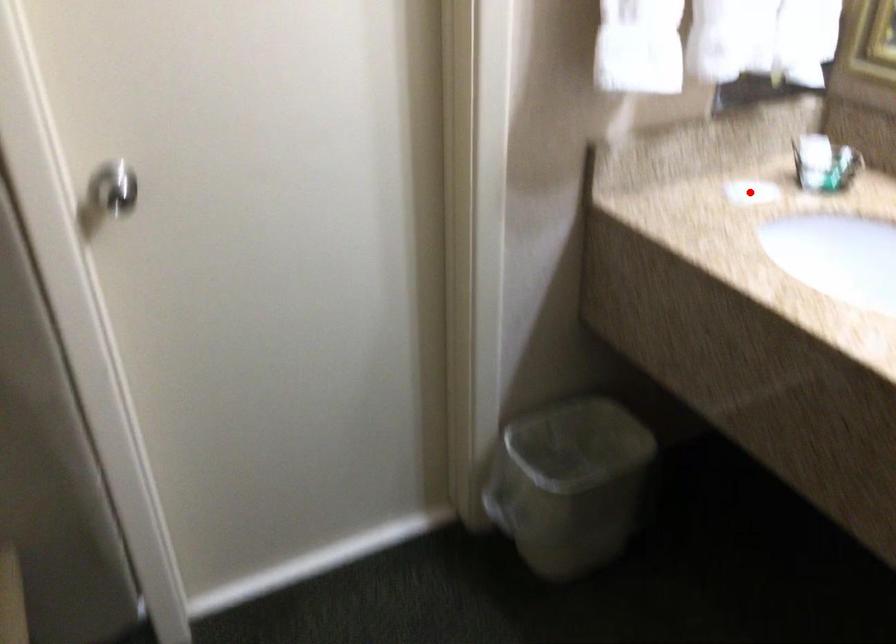
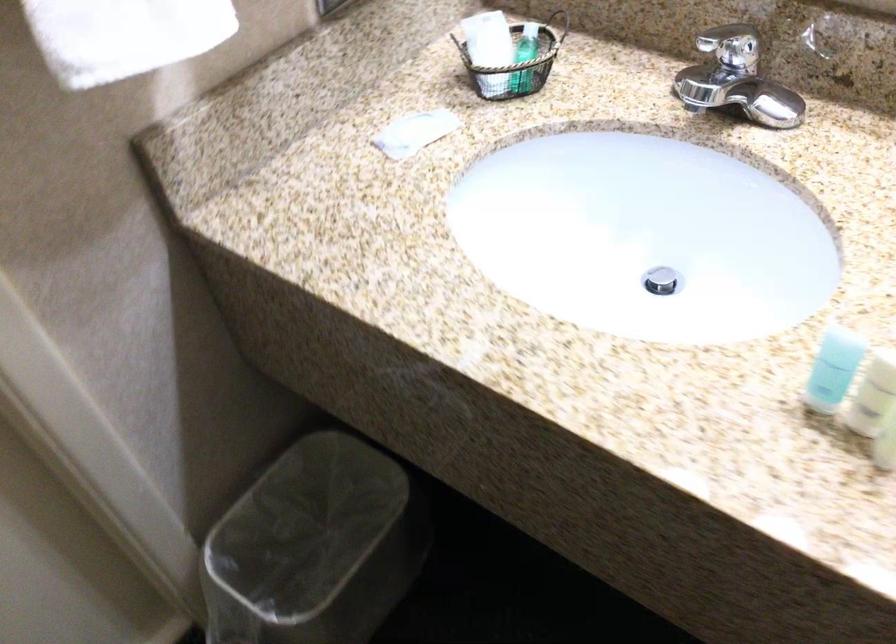
The point at the highlighted location is marked in the first image. Where is the corresponding point in the second image?

(414, 131)